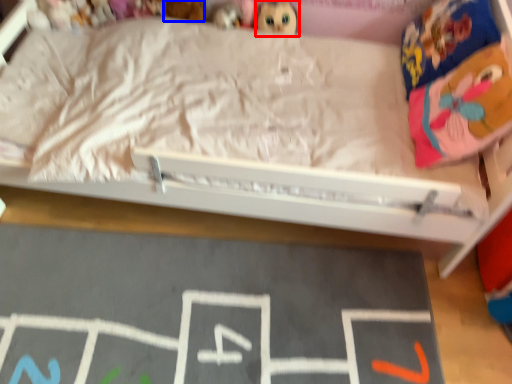
Question: Which object is closer to the camera taking this photo, toy (highlighted by a red box) or toy (highlighted by a blue box)?

Choices:
 (A) toy
 (B) toy

Answer: (B)